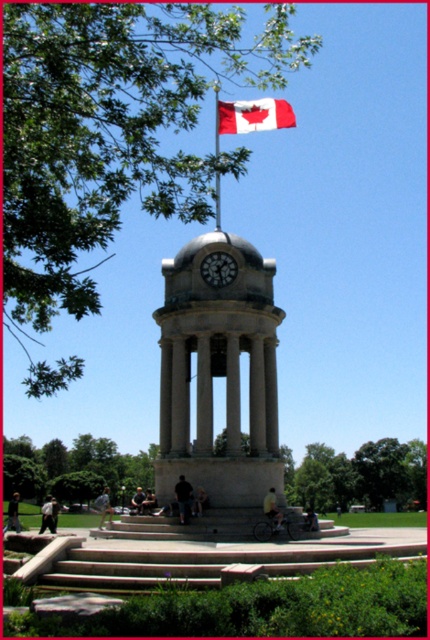
Question: Is white marble clock tower at center behind metallic flag pole at upper center?

Choices:
 (A) yes
 (B) no

Answer: (A)

Question: Among these points, which one is nearest to the camera?

Choices:
 (A) (245, 100)
 (B) (168, 353)

Answer: (B)

Question: Can you confirm if matte gray clock at center is positioned above metallic flag pole at upper center?

Choices:
 (A) yes
 (B) no

Answer: (B)

Question: Which point is farther to the camera?

Choices:
 (A) (227, 253)
 (B) (162, 352)
 (C) (215, 132)
 (D) (267, 109)

Answer: (C)

Question: Is white marble clock tower at center above white cotton flag at upper center?

Choices:
 (A) yes
 (B) no

Answer: (B)

Question: Which of these objects is positioned farthest from the matte gray clock at center?

Choices:
 (A) white cotton flag at upper center
 (B) metallic flag pole at upper center
 (C) white marble clock tower at center

Answer: (A)